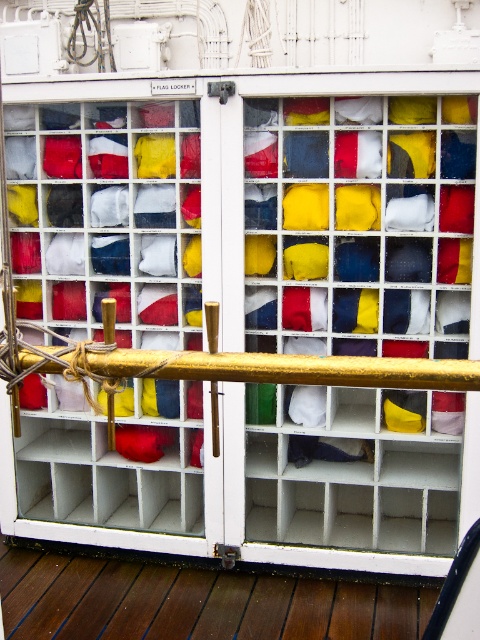
You are a sailor on the ship and need to secure a rope to the railing. You are currently standing on the brown wooden deck at lower center. Which direction should you move to reach the gold polished metal rail at center?

Since the brown wooden deck at lower center is located below the gold polished metal rail at center, you should move upward to reach the gold polished metal rail at center from the brown wooden deck at lower center.

You are standing on the ship and want to place a new flag in the FLAG LOCKER. The locker is at point (195, 602). Where exactly should you place the flag?

The brown wooden deck at lower center is located at point (195, 602), so you should place the flag in the locker there.

Consider the image. You are a sailor on the ship and need to secure a new flag in the FLAG LOCKER. You have a large flag that requires a surface bigger than the gold polished metal rail at center. Can the brown wooden deck at lower center accommodate it?

The brown wooden deck at lower center has a larger size compared to the gold polished metal rail at center, so the deck can accommodate the large flag.